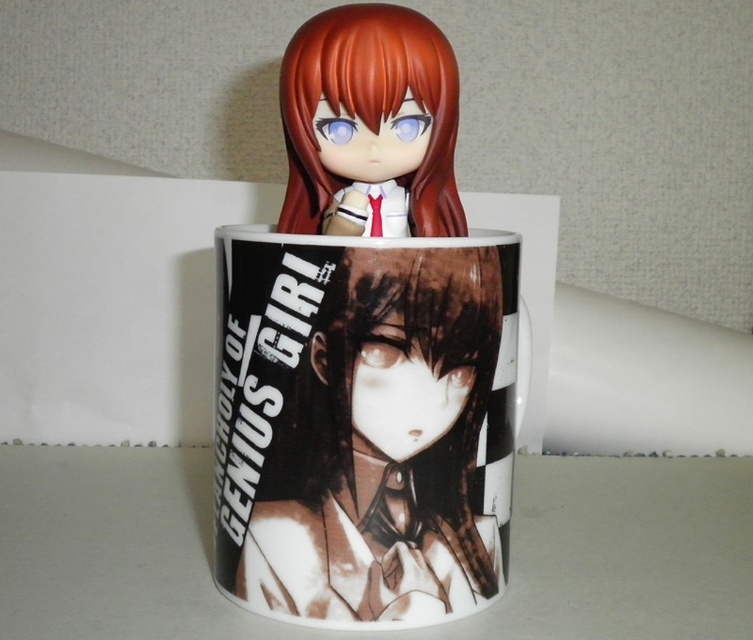
Question: Does white glossy mug at center have a lesser width compared to matte plastic doll at upper center?

Choices:
 (A) yes
 (B) no

Answer: (B)

Question: Where is white glossy mug at center located in relation to matte plastic doll at upper center in the image?

Choices:
 (A) above
 (B) below

Answer: (B)

Question: Is white glossy mug at center below matte plastic doll at upper center?

Choices:
 (A) no
 (B) yes

Answer: (B)

Question: Which of the following is the closest to the observer?

Choices:
 (A) matte plastic doll at upper center
 (B) white glossy mug at center

Answer: (B)

Question: Which of the following is the closest to the observer?

Choices:
 (A) (430, 35)
 (B) (392, 253)

Answer: (B)